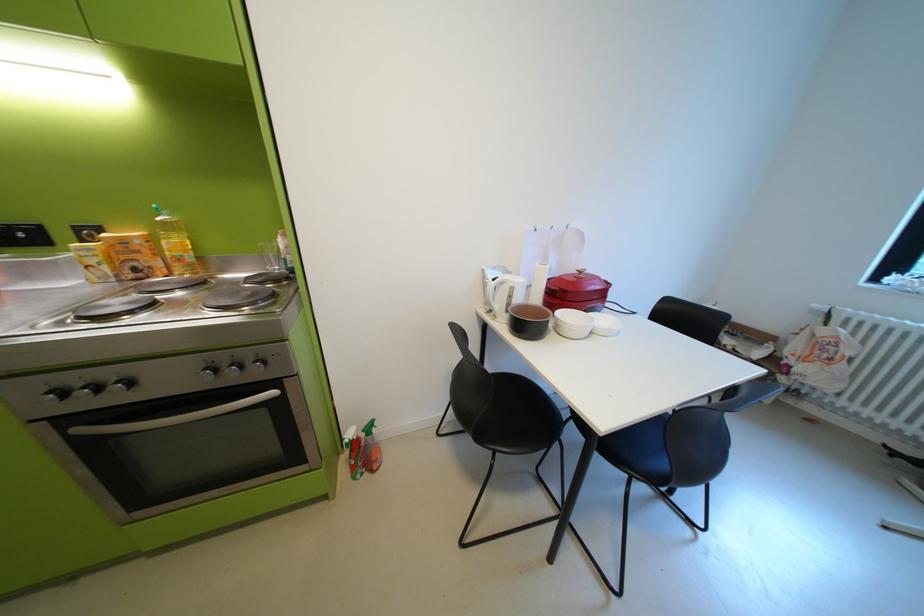
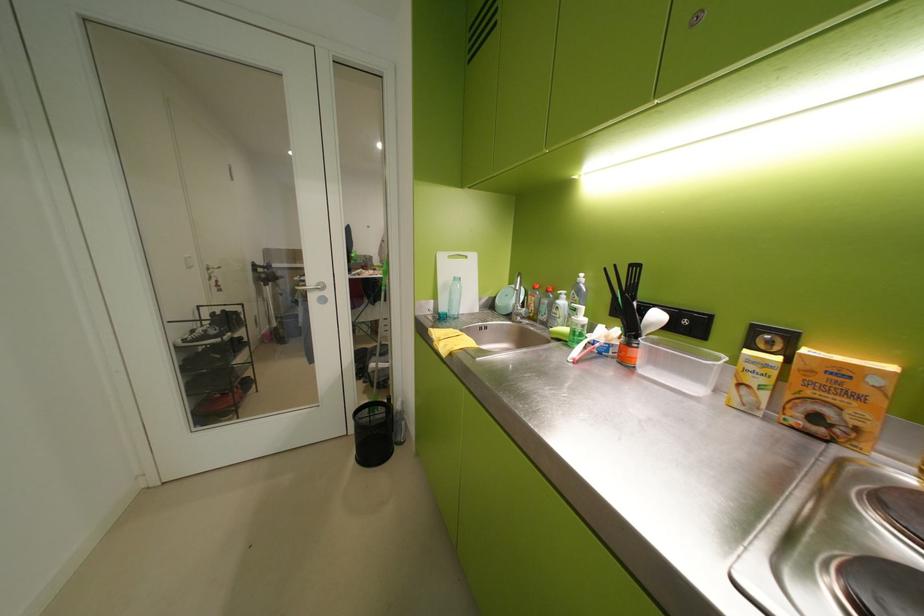
Where in the second image is the point corresponding to point (100, 251) from the first image?

(773, 365)